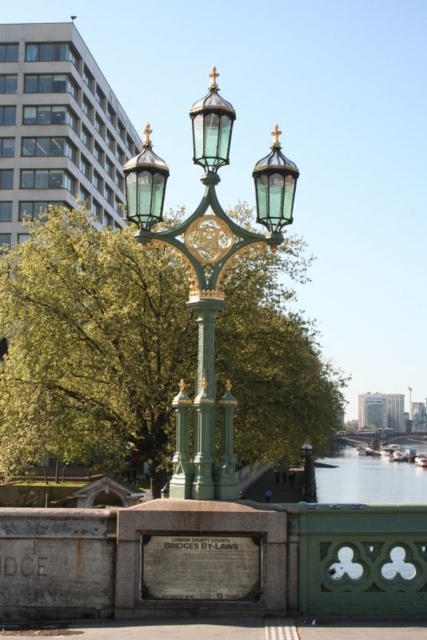
Question: Is green polished metal street light at center thinner than green glass street light at center?

Choices:
 (A) no
 (B) yes

Answer: (A)

Question: Which point is farther from the camera taking this photo?

Choices:
 (A) click(385, 492)
 (B) click(64, 230)

Answer: (A)

Question: Which object is the closest to the green leafy tree at center?

Choices:
 (A) clear water at lower right
 (B) green glass street light at center

Answer: (B)

Question: Which point is farther to the camera?

Choices:
 (A) clear water at lower right
 (B) green glass street light at center
 (C) green leafy tree at center

Answer: (A)

Question: Does green polished metal street light at center appear on the right side of green glass street light at center?

Choices:
 (A) yes
 (B) no

Answer: (B)

Question: Does green polished metal street light at center appear over clear water at lower right?

Choices:
 (A) yes
 (B) no

Answer: (A)